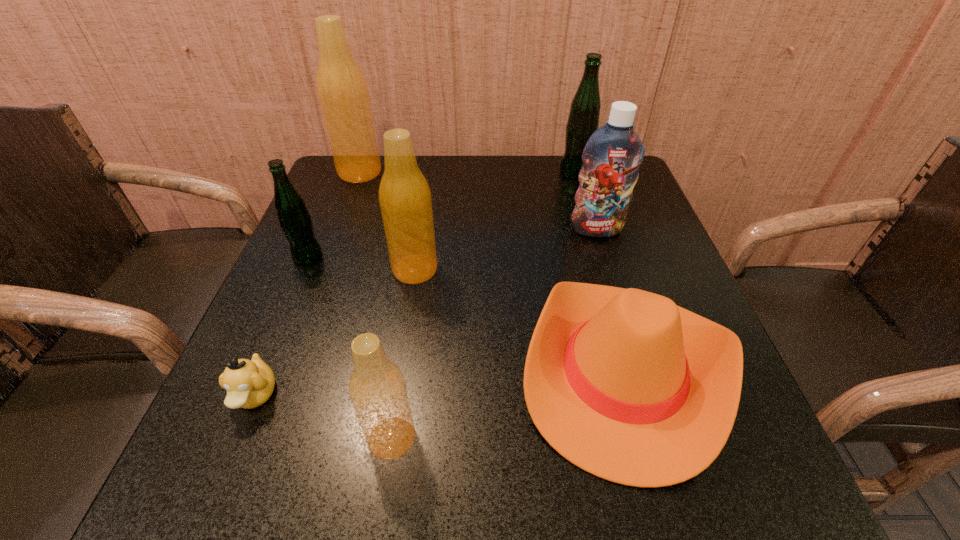
Locate an element on the screen. The width and height of the screenshot is (960, 540). unoccupied position between the nearest beer bottle and the second smallest tan beer bottle is located at coordinates (403, 354).

Where is `free space between the nearest tan beer bottle and the third farthest object`? The image size is (960, 540). free space between the nearest tan beer bottle and the third farthest object is located at coordinates (494, 333).

Locate an element on the screen. The image size is (960, 540). free point between the right green beer bottle and the leftmost tan beer bottle is located at coordinates point(468,172).

The height and width of the screenshot is (540, 960). Find the location of `vacant area that lies between the sixth nearest object and the tallest object`. vacant area that lies between the sixth nearest object and the tallest object is located at coordinates (478, 201).

Identify which object is located as the nearest to the second nearest tan beer bottle. Please provide its 2D coordinates. Your answer should be formatted as a tuple, i.e. [(x, y)], where the tuple contains the x and y coordinates of a point satisfying the conditions above.

[(623, 383)]

Image resolution: width=960 pixels, height=540 pixels. Identify the location of object that ranks as the fifth closest to the farther green beer bottle. (295, 221).

Identify which beer bottle is located as the third nearest to the tan duckling. Please provide its 2D coordinates. Your answer should be formatted as a tuple, i.e. [(x, y)], where the tuple contains the x and y coordinates of a point satisfying the conditions above.

[(295, 221)]

Locate an element on the screen. The width and height of the screenshot is (960, 540). beer bottle that is the second closest to the biggest tan beer bottle is located at coordinates (405, 199).

Choose which tan beer bottle is the second nearest neighbor to the left green beer bottle. Please provide its 2D coordinates. Your answer should be formatted as a tuple, i.e. [(x, y)], where the tuple contains the x and y coordinates of a point satisfying the conditions above.

[(342, 90)]

Where is `the closest tan beer bottle to the blue shampoo`? This screenshot has width=960, height=540. the closest tan beer bottle to the blue shampoo is located at coordinates (405, 199).